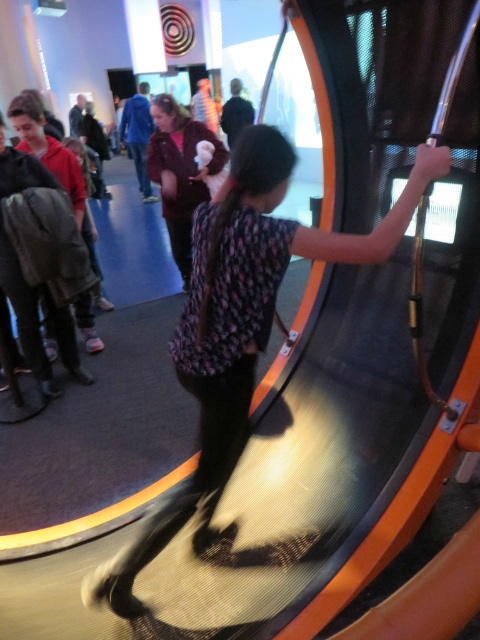
Which is above, patterned fabric dress at center or velvet brown coat at center?

velvet brown coat at center is higher up.

Who is shorter, patterned fabric dress at center or velvet brown coat at center?

velvet brown coat at center

Who is more forward, [103,586] or [154,104]?

Point [103,586] is more forward.

Where is `patterned fabric dress at center`? patterned fabric dress at center is located at coordinates (240, 330).